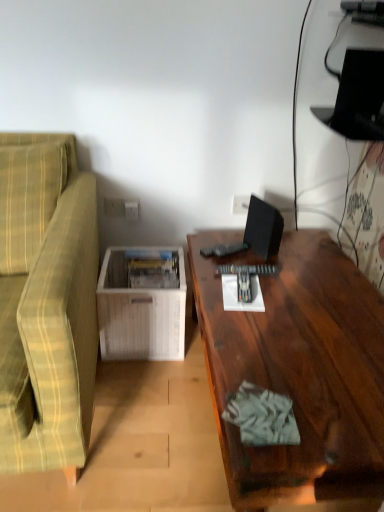
Image resolution: width=384 pixels, height=512 pixels. I want to click on unoccupied region to the right of black matte computer monitor at upper right, so click(305, 251).